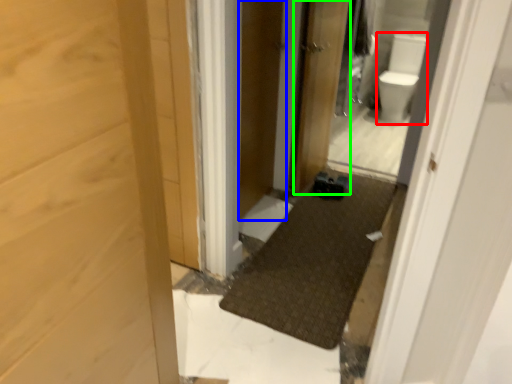
Question: Which object is positioned farthest from toilet bowl (highlighted by a red box)? Select from screen door (highlighted by a blue box) and door (highlighted by a green box).

Choices:
 (A) screen door
 (B) door

Answer: (A)